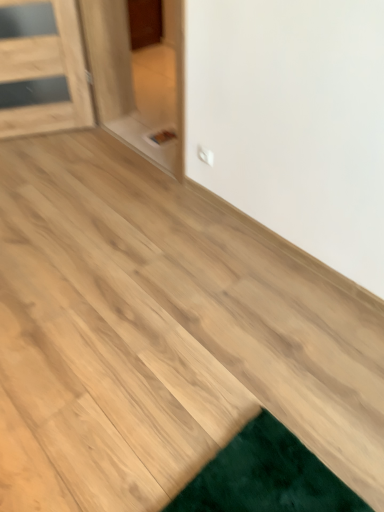
Question: Do you think transparent glass door at center is within natural wood floor at center, or outside of it?

Choices:
 (A) outside
 (B) inside

Answer: (A)

Question: Considering the positions of transparent glass door at center and natural wood floor at center in the image, is transparent glass door at center bigger or smaller than natural wood floor at center?

Choices:
 (A) big
 (B) small

Answer: (A)

Question: In terms of width, does transparent glass door at center look wider or thinner when compared to natural wood floor at center?

Choices:
 (A) wide
 (B) thin

Answer: (B)

Question: Is natural wood floor at center situated inside transparent glass door at center or outside?

Choices:
 (A) inside
 (B) outside

Answer: (B)

Question: Is point (59, 266) positioned closer to the camera than point (115, 113)?

Choices:
 (A) closer
 (B) farther

Answer: (A)

Question: From the image's perspective, is natural wood floor at center above or below transparent glass door at center?

Choices:
 (A) above
 (B) below

Answer: (B)

Question: In the image, is natural wood floor at center positioned in front of or behind transparent glass door at center?

Choices:
 (A) front
 (B) behind

Answer: (A)